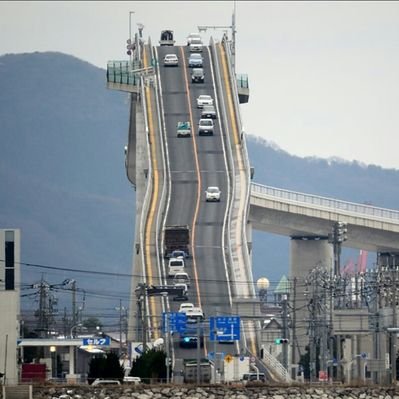
I want to click on stair, so click(x=12, y=392).